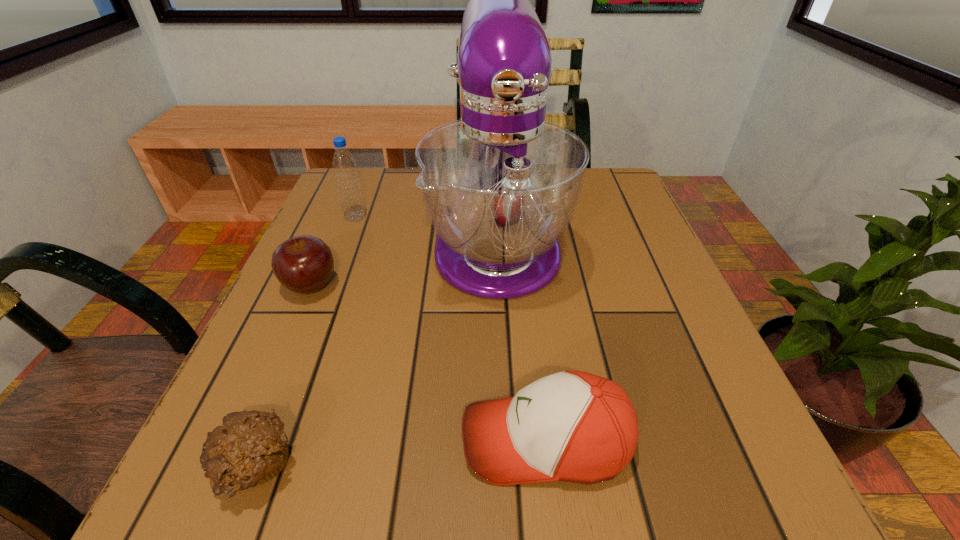
Locate an element on the screen. unoccupied area between the shortest object and the tallest object is located at coordinates (376, 353).

The width and height of the screenshot is (960, 540). What are the coordinates of `empty space between the water bottle and the baseball cap` in the screenshot? It's located at (451, 329).

The image size is (960, 540). What are the coordinates of `free space between the apple and the baseball cap` in the screenshot? It's located at pyautogui.click(x=428, y=363).

Find the location of a particular element. empty space that is in between the shortest object and the second tallest object is located at coordinates (305, 342).

Where is `vacant area between the water bottle and the tallest object`? Image resolution: width=960 pixels, height=540 pixels. vacant area between the water bottle and the tallest object is located at coordinates (426, 227).

This screenshot has width=960, height=540. Identify the location of free space between the tallest object and the baseball cap. (521, 339).

The height and width of the screenshot is (540, 960). What are the coordinates of `unoccupied position between the mixer and the water bottle` in the screenshot? It's located at (426, 227).

At what (x,y) coordinates should I click in order to perform the action: click on object that ranks as the third closest to the baseball cap. Please return your answer as a coordinate pair (x, y). Image resolution: width=960 pixels, height=540 pixels. Looking at the image, I should click on (303, 264).

Identify which object is the nearest to the fourth shortest object. Please provide its 2D coordinates. Your answer should be formatted as a tuple, i.e. [(x, y)], where the tuple contains the x and y coordinates of a point satisfying the conditions above.

[(501, 185)]